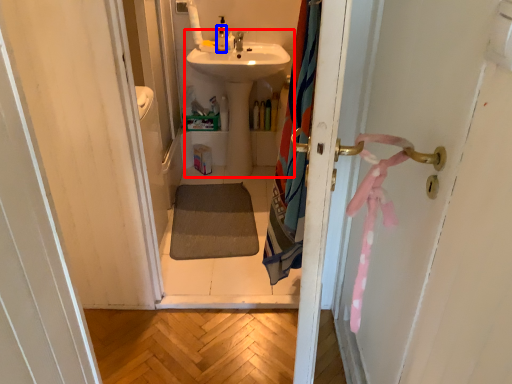
Question: Which object is further to the camera taking this photo, sink (highlighted by a red box) or toiletry (highlighted by a blue box)?

Choices:
 (A) sink
 (B) toiletry

Answer: (B)